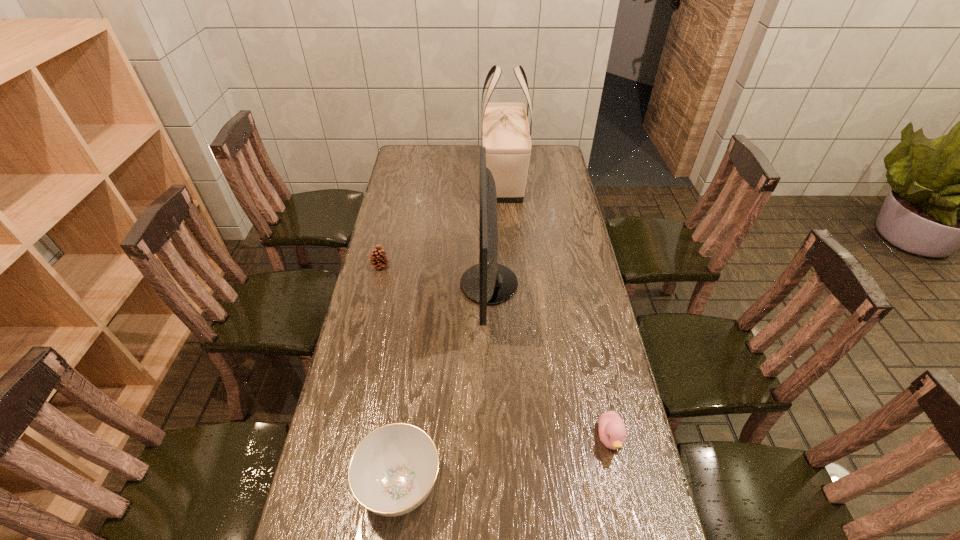
Locate an element on the screen. This screenshot has height=540, width=960. the tallest object is located at coordinates (505, 129).

The height and width of the screenshot is (540, 960). Find the location of `the farthest object`. the farthest object is located at coordinates (505, 129).

Locate an element on the screen. This screenshot has height=540, width=960. monitor is located at coordinates (488, 283).

Find the location of a particular element. This screenshot has width=960, height=540. chinaware is located at coordinates (392, 471).

This screenshot has width=960, height=540. Identify the location of pinecone. (378, 259).

At what (x,y) coordinates should I click in order to perform the action: click on duckling. Please return your answer as a coordinate pair (x, y). This screenshot has height=540, width=960. Looking at the image, I should click on (612, 431).

Image resolution: width=960 pixels, height=540 pixels. In order to click on vacant space positioned with handles facing forward on the farthest object in this screenshot , I will do `click(508, 240)`.

At what (x,y) coordinates should I click in order to perform the action: click on free spot located on the screen side of the second tallest object. Please return your answer as a coordinate pair (x, y). Image resolution: width=960 pixels, height=540 pixels. Looking at the image, I should click on (404, 285).

The image size is (960, 540). I want to click on vacant position located on the screen side of the second tallest object, so click(407, 285).

Locate an element on the screen. free space located 0.310m on the screen side of the second tallest object is located at coordinates pyautogui.click(x=373, y=285).